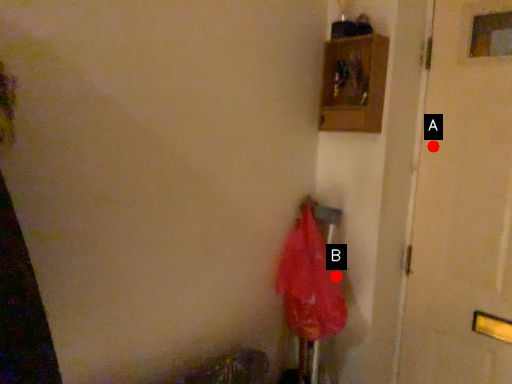
Question: Two points are circled on the image, labeled by A and B beside each circle. Which point is closer to the camera?

Choices:
 (A) A is closer
 (B) B is closer

Answer: (A)